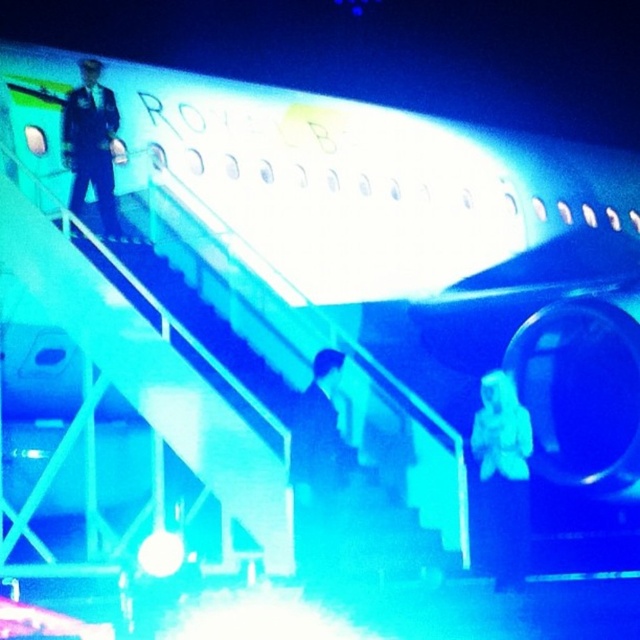
You are standing at the bottom of the staircase leading to the private jet. You need to take a photo of the dark blue uniform at left and the camera. How far apart are these two objects?

The dark blue uniform at left and the camera are 75.80 feet apart.

You are a photographer positioned at the bottom of the staircase. You need to capture a photo of both the white matte suit at center and the dark blue uniform at left. Which subject will appear smaller in the photo?

The white matte suit at center will appear smaller in the photo because it is not as tall as the dark blue uniform at left.